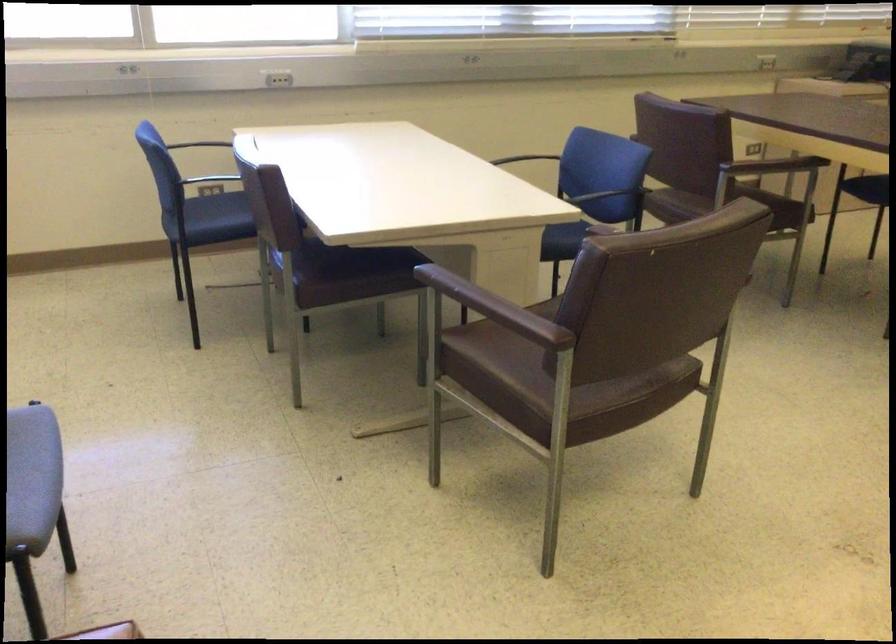
Find where to resting arm the black chair armrest. Please return your answer as a coordinate pair (x, y).

(521, 158)